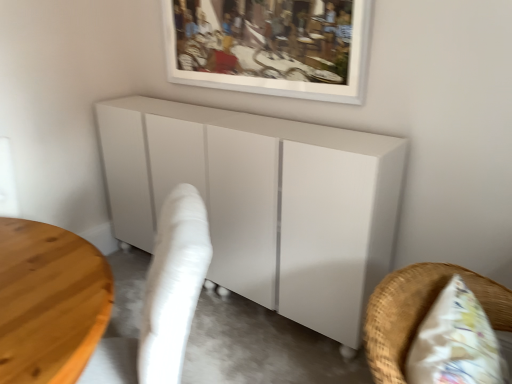
Question: Is the depth of white fabric swivel chair at lower left greater than that of white wicker chair at lower right, the first furniture from the front?

Choices:
 (A) yes
 (B) no

Answer: (A)

Question: Is white fabric swivel chair at lower left far from white wicker chair at lower right, the first furniture from the front?

Choices:
 (A) no
 (B) yes

Answer: (A)

Question: From the image's perspective, is white fabric swivel chair at lower left below white wicker chair at lower right, the first furniture from the front?

Choices:
 (A) yes
 (B) no

Answer: (A)

Question: Does white fabric swivel chair at lower left appear on the right side of white wicker chair at lower right, positioned as the 2th furniture in back-to-front order?

Choices:
 (A) no
 (B) yes

Answer: (A)

Question: Is white fabric swivel chair at lower left outside of white wicker chair at lower right, positioned as the 2th furniture in back-to-front order?

Choices:
 (A) no
 (B) yes

Answer: (B)

Question: From a real-world perspective, is white glossy cabinet at center, the 1th furniture positioned from the back, positioned above or below white fabric swivel chair at lower left?

Choices:
 (A) above
 (B) below

Answer: (A)

Question: Is white glossy cabinet at center, the 1th furniture positioned from the back, taller or shorter than white fabric swivel chair at lower left?

Choices:
 (A) short
 (B) tall

Answer: (B)

Question: Is point pos(266,213) positioned closer to the camera than point pos(123,372)?

Choices:
 (A) farther
 (B) closer

Answer: (A)

Question: Considering the positions of white glossy cabinet at center, which ranks as the 2th furniture in front-to-back order, and white fabric swivel chair at lower left in the image, is white glossy cabinet at center, which ranks as the 2th furniture in front-to-back order, wider or thinner than white fabric swivel chair at lower left?

Choices:
 (A) wide
 (B) thin

Answer: (B)

Question: Considering their positions, is white matte picture frame at upper center located in front of or behind white fabric swivel chair at lower left?

Choices:
 (A) front
 (B) behind

Answer: (B)

Question: Is white matte picture frame at upper center inside or outside of white fabric swivel chair at lower left?

Choices:
 (A) outside
 (B) inside

Answer: (A)

Question: Is white matte picture frame at upper center taller or shorter than white fabric swivel chair at lower left?

Choices:
 (A) tall
 (B) short

Answer: (B)

Question: From the image's perspective, is white matte picture frame at upper center located above or below white fabric swivel chair at lower left?

Choices:
 (A) above
 (B) below

Answer: (A)

Question: Looking at their shapes, would you say white glossy cabinet at center, the 1th furniture positioned from the back, is wider or thinner than white wicker chair at lower right, positioned as the 2th furniture in back-to-front order?

Choices:
 (A) wide
 (B) thin

Answer: (A)

Question: Does point (274, 180) appear closer or farther from the camera than point (412, 332)?

Choices:
 (A) farther
 (B) closer

Answer: (A)